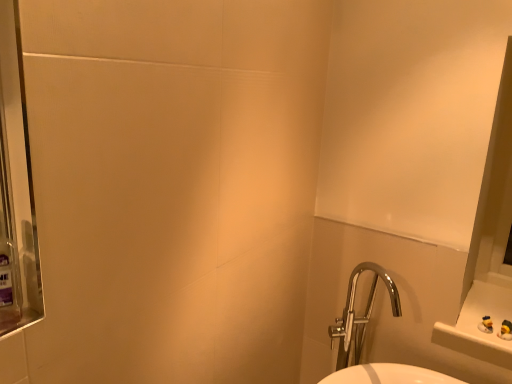
Question: Considering the positions of translucent purple mouthwash at left and chrome metallic sink at lower right in the image, is translucent purple mouthwash at left taller or shorter than chrome metallic sink at lower right?

Choices:
 (A) short
 (B) tall

Answer: (A)

Question: From the image's perspective, is translucent purple mouthwash at left above or below chrome metallic sink at lower right?

Choices:
 (A) below
 (B) above

Answer: (B)

Question: Is translucent purple mouthwash at left to the left or to the right of chrome metallic sink at lower right in the image?

Choices:
 (A) left
 (B) right

Answer: (A)

Question: Is point [x=392, y=284] closer or farther from the camera than point [x=12, y=261]?

Choices:
 (A) farther
 (B) closer

Answer: (A)

Question: Considering the positions of chrome metallic sink at lower right and translucent purple mouthwash at left in the image, is chrome metallic sink at lower right bigger or smaller than translucent purple mouthwash at left?

Choices:
 (A) big
 (B) small

Answer: (A)

Question: Do you think chrome metallic sink at lower right is within translucent purple mouthwash at left, or outside of it?

Choices:
 (A) inside
 (B) outside

Answer: (B)

Question: Looking at their shapes, would you say chrome metallic sink at lower right is wider or thinner than translucent purple mouthwash at left?

Choices:
 (A) wide
 (B) thin

Answer: (A)